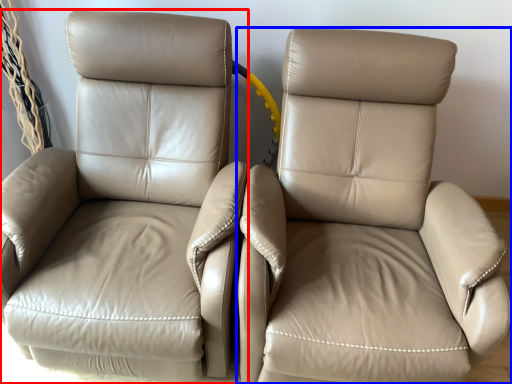
Question: Which object is closer to the camera taking this photo, chair (highlighted by a red box) or chair (highlighted by a blue box)?

Choices:
 (A) chair
 (B) chair

Answer: (B)